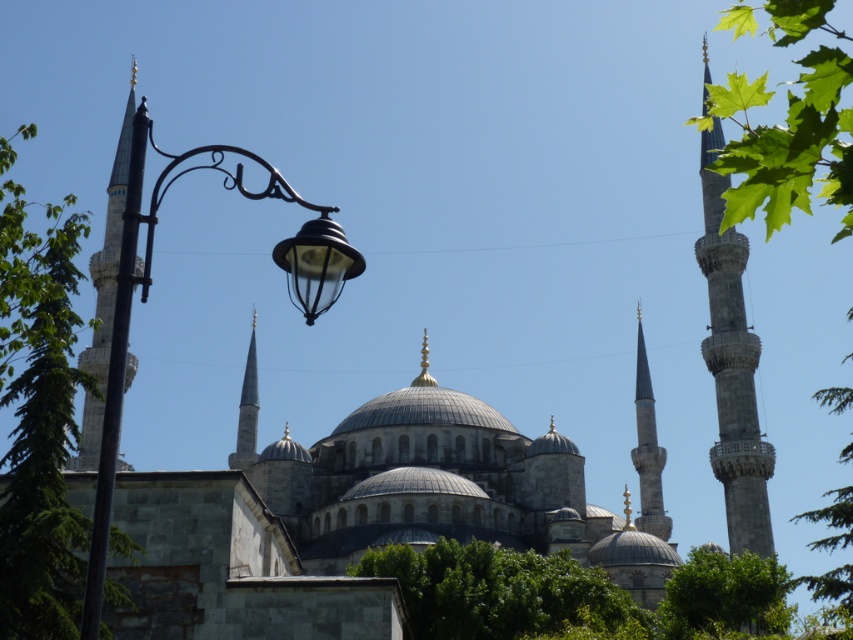
You are standing in front of the mosque and notice the black wrought iron street light at left and the gray stone minaret at upper right. Which object is positioned more to the left side of the scene?

The black wrought iron street light at left is positioned more to the left side of the scene compared to the gray stone minaret at upper right.